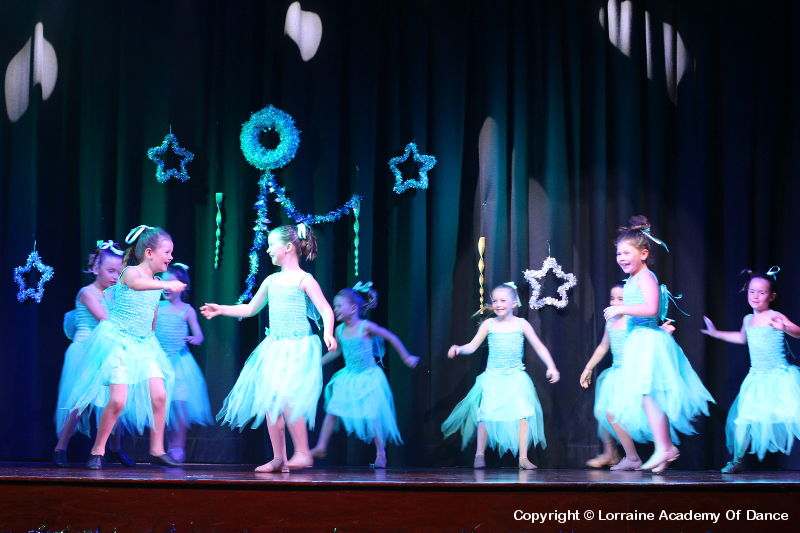
Image resolution: width=800 pixels, height=533 pixels. I want to click on dark blue curtains, so click(x=73, y=139), click(x=392, y=115), click(x=706, y=171).